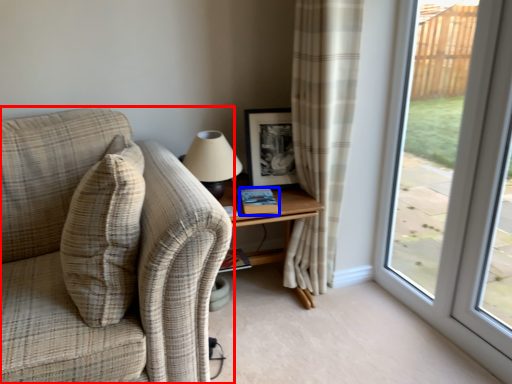
Question: Which object is further to the camera taking this photo, studio couch (highlighted by a red box) or book (highlighted by a blue box)?

Choices:
 (A) studio couch
 (B) book

Answer: (B)